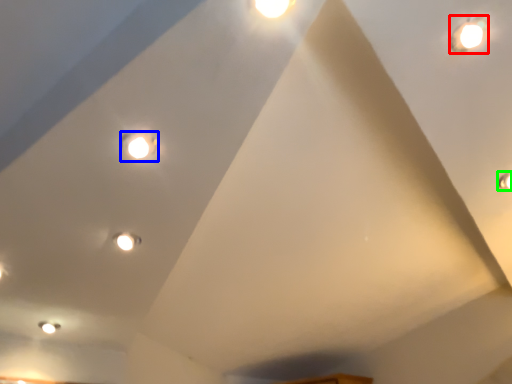
Question: Based on their relative distances, which object is farther from droplight (highlighted by a red box)? Choose from light (highlighted by a blue box) and light (highlighted by a green box).

Choices:
 (A) light
 (B) light

Answer: (A)